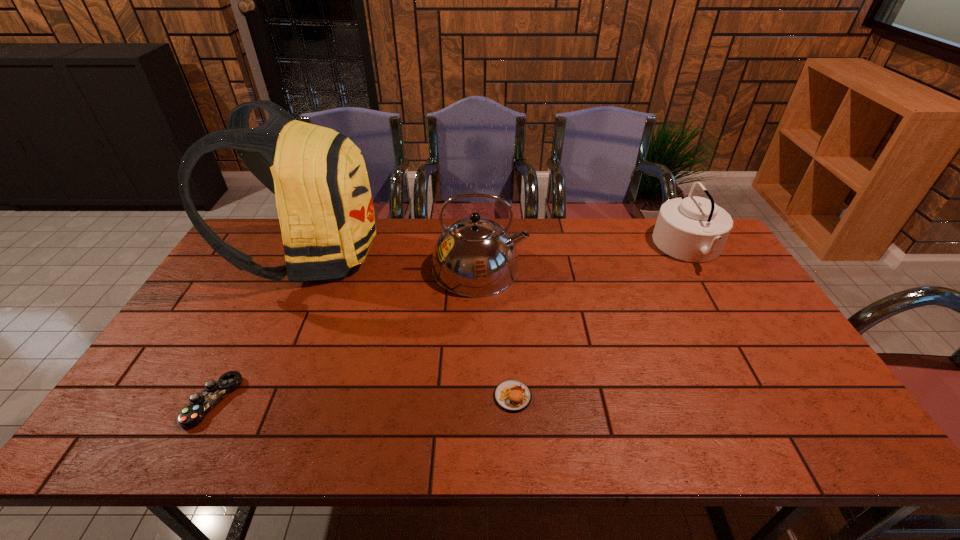
Where is `vacant space located 0.180m on the spout of the rightmost object`? The width and height of the screenshot is (960, 540). vacant space located 0.180m on the spout of the rightmost object is located at coordinates (603, 247).

In order to click on free space located 0.350m on the spout of the rightmost object in this screenshot , I will do `click(553, 247)`.

At what (x,y) coordinates should I click in order to perform the action: click on vacant space located 0.190m on the back of the patty. Please return your answer as a coordinate pair (x, y). Looking at the image, I should click on (508, 325).

Where is `free spot located on the back of the shortest object`? free spot located on the back of the shortest object is located at coordinates (243, 345).

At what (x,y) coordinates should I click in order to perform the action: click on backpack present at the far edge. Please return your answer as a coordinate pair (x, y). The image size is (960, 540). Looking at the image, I should click on (320, 180).

The image size is (960, 540). In order to click on object that is at the near edge in this screenshot , I will do `click(200, 404)`.

The height and width of the screenshot is (540, 960). Identify the location of backpack positioned at the left edge. (320, 180).

Find the location of a particular element. Image resolution: width=960 pixels, height=540 pixels. control at the left edge is located at coordinates (200, 404).

Identify the location of object at the right edge. (694, 229).

Where is `object that is at the far left corner`? This screenshot has width=960, height=540. object that is at the far left corner is located at coordinates (320, 180).